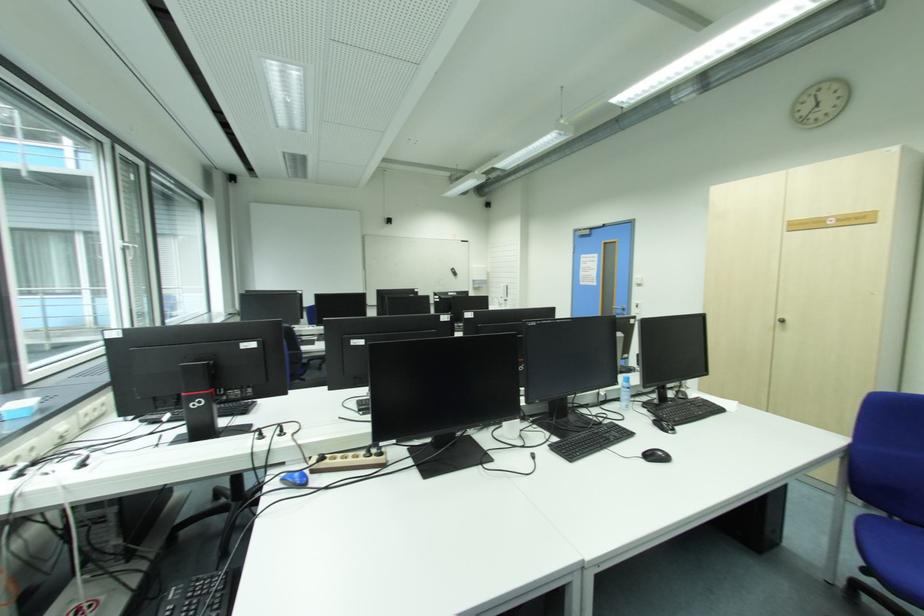
Where would you push the red power strip button? Please return your answer as a coordinate pair (x, y).

(84, 607)